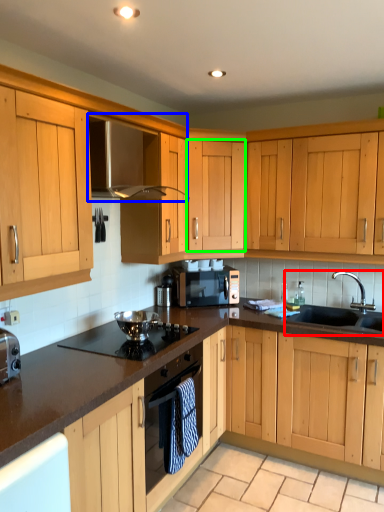
Question: Which is nearer to the sink (highlighted by a red box)? exhaust hood (highlighted by a blue box) or cabinetry (highlighted by a green box).

Choices:
 (A) exhaust hood
 (B) cabinetry

Answer: (B)